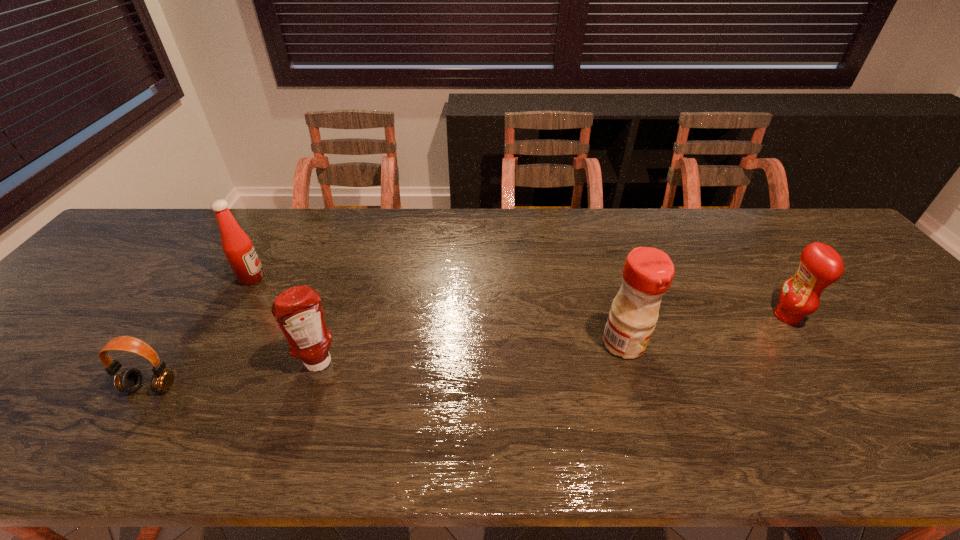
Locate an element on the screen. the third condiment from left to right is located at coordinates (648, 272).

Find the location of a particular element. the leftmost condiment is located at coordinates (237, 246).

Image resolution: width=960 pixels, height=540 pixels. Find the location of `the farthest object`. the farthest object is located at coordinates (237, 246).

Locate an element on the screen. This screenshot has width=960, height=540. the second condiment from left to right is located at coordinates (298, 312).

Locate an element on the screen. This screenshot has width=960, height=540. the rightmost object is located at coordinates (820, 265).

Find the location of a particular element. the shortest object is located at coordinates (129, 380).

Where is `vacant area located 0.320m on the right of the third condiment from left to right`? This screenshot has width=960, height=540. vacant area located 0.320m on the right of the third condiment from left to right is located at coordinates (780, 344).

Where is `free region located on the front-facing side of the farthest condiment`? The width and height of the screenshot is (960, 540). free region located on the front-facing side of the farthest condiment is located at coordinates (348, 278).

You are a GUI agent. You are given a task and a screenshot of the screen. Output one action in this format:
    pyautogui.click(x=<x>, y=<y>)
    Task: Click on the vacant area situated on the left of the third object from left to right
    This screenshot has height=540, width=960.
    Given the screenshot: What is the action you would take?
    pyautogui.click(x=209, y=363)

Find the location of a particular element. free space located on the label side of the rightmost object is located at coordinates (615, 316).